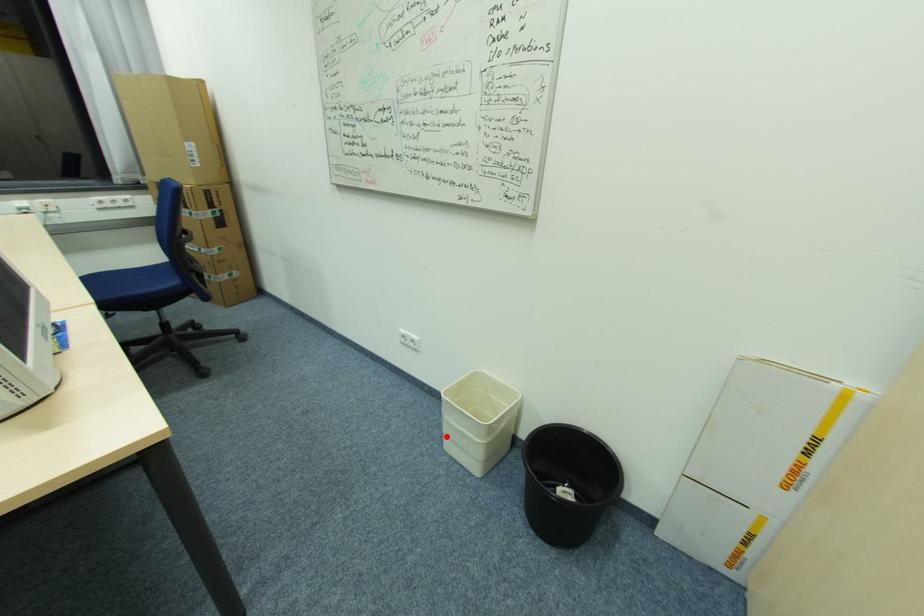
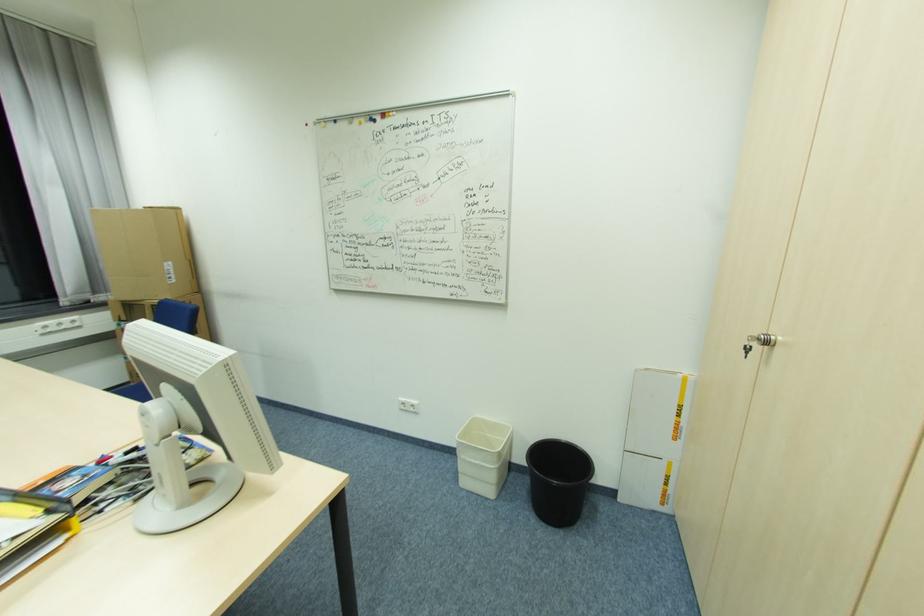
In the second image, find the point that corresponds to the highlighted location in the first image.

(463, 475)